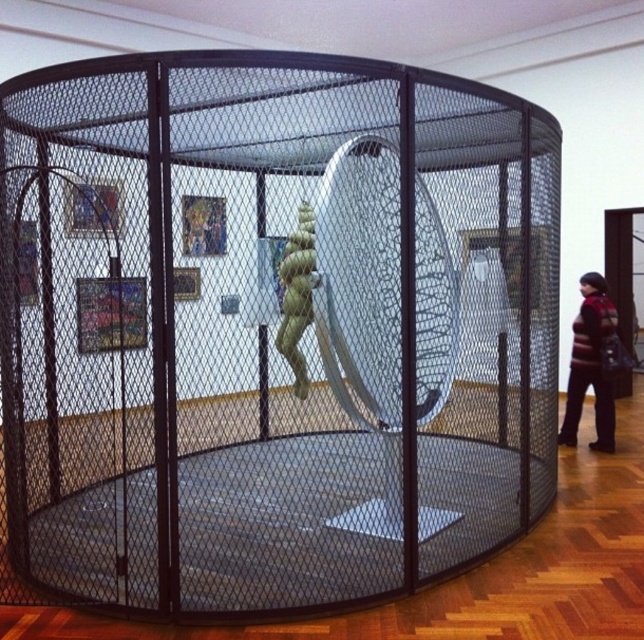
Can you confirm if striped sweater at right is taller than green matte sculpture at center?

Yes, striped sweater at right is taller than green matte sculpture at center.

Is point (578, 352) less distant than point (290, 310)?

No, it is not.

Is point (605, 436) closer to camera compared to point (289, 285)?

No, (605, 436) is further to viewer.

This screenshot has height=640, width=644. Identify the location of striped sweater at right. (591, 364).